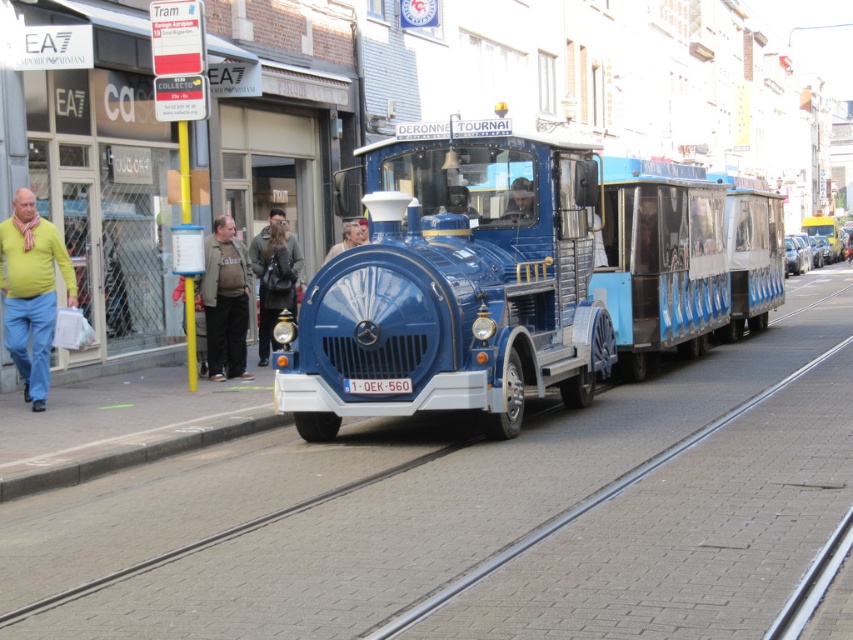
Who is positioned more to the right, dark brown leather jacket at center or smooth blue train at center?

Positioned to the right is smooth blue train at center.

Is point (293, 266) more distant than point (503, 216)?

Yes, it is.

Which is behind, point (277, 298) or point (529, 193)?

The point (277, 298) is more distant.

Image resolution: width=853 pixels, height=640 pixels. Identify the location of dark brown leather jacket at center. (274, 284).

Does dark brown leather jacket at center have a larger size compared to metallic silver car at center?

No, dark brown leather jacket at center is not bigger than metallic silver car at center.

Measure the distance from dark brown leather jacket at center to metallic silver car at center.

16.82 meters

Between point (294, 312) and point (790, 248), which one is positioned in front?

Point (294, 312)

Locate an element on the screen. dark brown leather jacket at center is located at coordinates (274, 284).

Looking at this image, does smooth blue train at center have a greater height compared to metallic silver car at center?

No.

Is smooth blue train at center positioned at the back of metallic silver car at center?

No.

This screenshot has height=640, width=853. I want to click on smooth blue train at center, so click(519, 200).